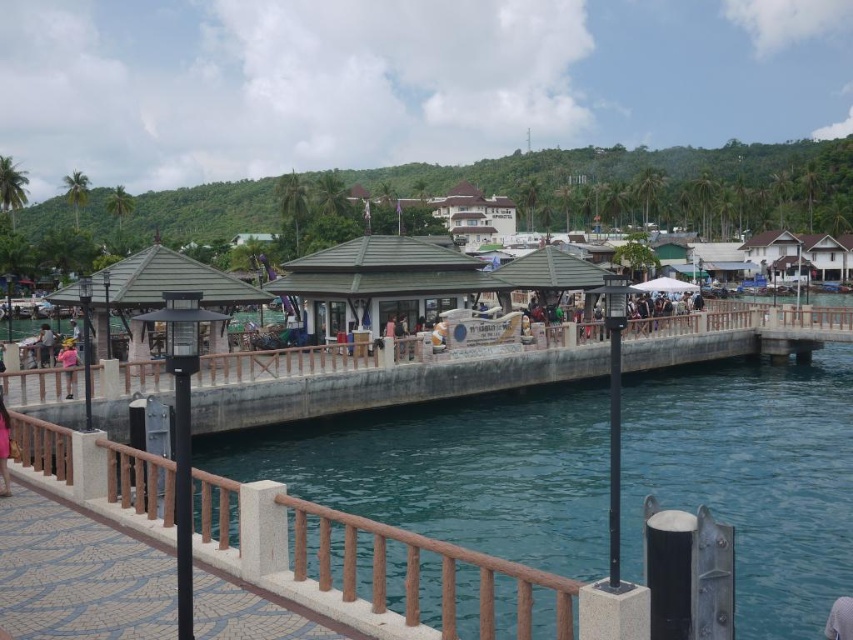
Question: Can you confirm if brown polished wood rail at lower center is wider than matte black jacket at center?

Choices:
 (A) no
 (B) yes

Answer: (B)

Question: Which object is the farthest from the brown polished wood rail at lower center?

Choices:
 (A) green matte gazebo at center
 (B) pink fabric dress at lower left
 (C) pink fabric at lower left

Answer: (C)

Question: Is the position of matte black jacket at center more distant than that of pink fabric dress at lower left?

Choices:
 (A) no
 (B) yes

Answer: (A)

Question: Among these points, which one is nearest to the camera?

Choices:
 (A) (386, 486)
 (B) (419, 547)

Answer: (B)

Question: Estimate the real-world distances between objects in this image. Which object is closer to the brown polished wood rail at lower center?

Choices:
 (A) matte black jacket at center
 (B) pink fabric at center
 (C) green matte gazebo at center

Answer: (B)

Question: Can you confirm if pink fabric dress at lower left is wider than pink fabric at center?

Choices:
 (A) no
 (B) yes

Answer: (A)